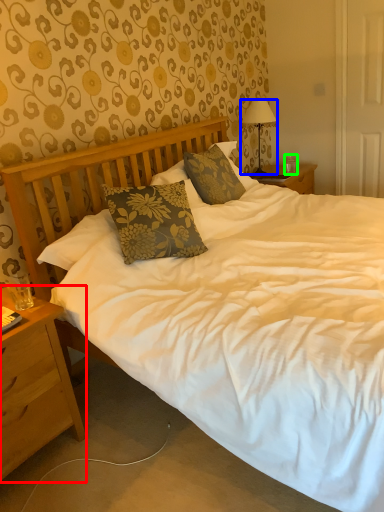
Question: Which object is the farthest from nightstand (highlighted by a red box)? Choose among these: lamp (highlighted by a blue box) or coffee cup (highlighted by a green box).

Choices:
 (A) lamp
 (B) coffee cup

Answer: (B)